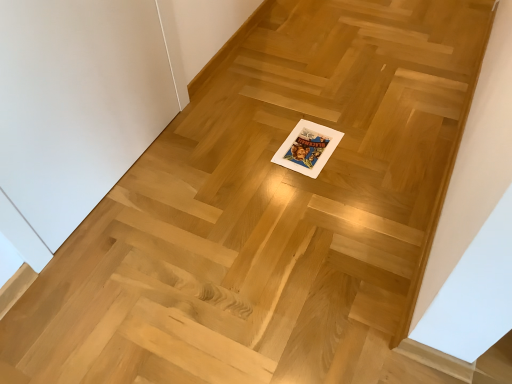
Identify the location of empty space that is ontop of white paper at center (from a real-world perspective). This screenshot has height=384, width=512. tap(309, 146).